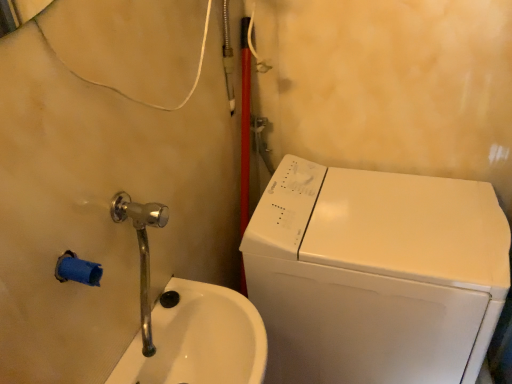
Question: Is white glossy washing machine at right bigger than polished chrome faucet at lower left?

Choices:
 (A) no
 (B) yes

Answer: (B)

Question: Can you confirm if white glossy washing machine at right is smaller than polished chrome faucet at lower left?

Choices:
 (A) no
 (B) yes

Answer: (A)

Question: Is polished chrome faucet at lower left located within white glossy washing machine at right?

Choices:
 (A) yes
 (B) no

Answer: (B)

Question: Considering the relative sizes of white glossy washing machine at right and polished chrome faucet at lower left in the image provided, is white glossy washing machine at right wider than polished chrome faucet at lower left?

Choices:
 (A) yes
 (B) no

Answer: (A)

Question: From a real-world perspective, is white glossy washing machine at right under polished chrome faucet at lower left?

Choices:
 (A) no
 (B) yes

Answer: (B)

Question: Is white glossy washing machine at right behind polished chrome faucet at lower left?

Choices:
 (A) yes
 (B) no

Answer: (A)

Question: Is white glossy washing machine at right located outside white glossy sink at lower left?

Choices:
 (A) no
 (B) yes

Answer: (B)

Question: Is white glossy sink at lower left at the back of white glossy washing machine at right?

Choices:
 (A) no
 (B) yes

Answer: (A)

Question: Is white glossy washing machine at right closer to the viewer compared to white glossy sink at lower left?

Choices:
 (A) no
 (B) yes

Answer: (A)

Question: From the image's perspective, is white glossy washing machine at right below white glossy sink at lower left?

Choices:
 (A) yes
 (B) no

Answer: (A)

Question: Is the position of white glossy washing machine at right more distant than that of white glossy sink at lower left?

Choices:
 (A) no
 (B) yes

Answer: (B)

Question: Could white glossy sink at lower left be considered to be inside white glossy washing machine at right?

Choices:
 (A) no
 (B) yes

Answer: (A)

Question: Is white glossy sink at lower left to the right of polished chrome faucet at lower left from the viewer's perspective?

Choices:
 (A) yes
 (B) no

Answer: (A)